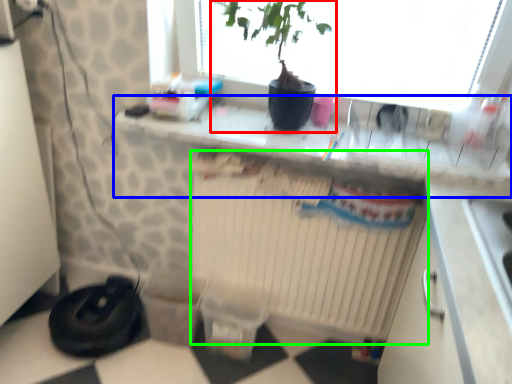
Question: Estimate the real-world distances between objects in this image. Which object is farther from houseplant (highlighted by a red box), counter top (highlighted by a blue box) or radiator (highlighted by a green box)?

Choices:
 (A) counter top
 (B) radiator

Answer: (B)